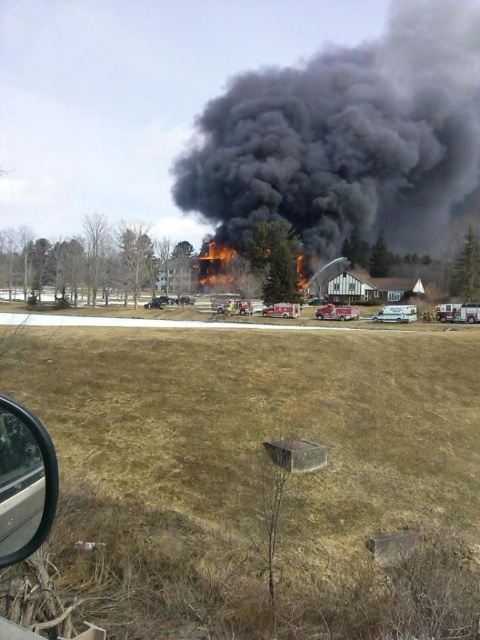
You are inside a car and want to observe the fire scene outside. Where is the transparent glass car window at lower left located in relation to your view?

The transparent glass car window at lower left is located at point (24, 483), which means it is positioned near the lower left corner of your view, allowing you to see the fire scene outside through it.